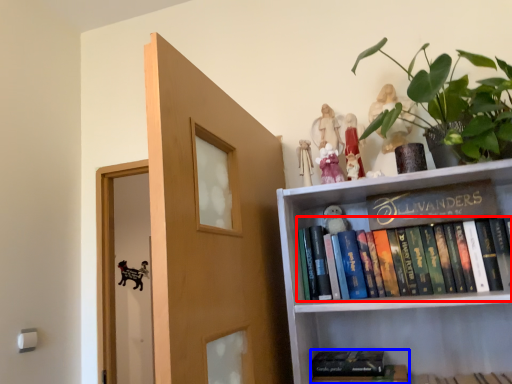
Question: Which of the following is the closest to the observer, book (highlighted by a red box) or book (highlighted by a blue box)?

Choices:
 (A) book
 (B) book

Answer: (A)